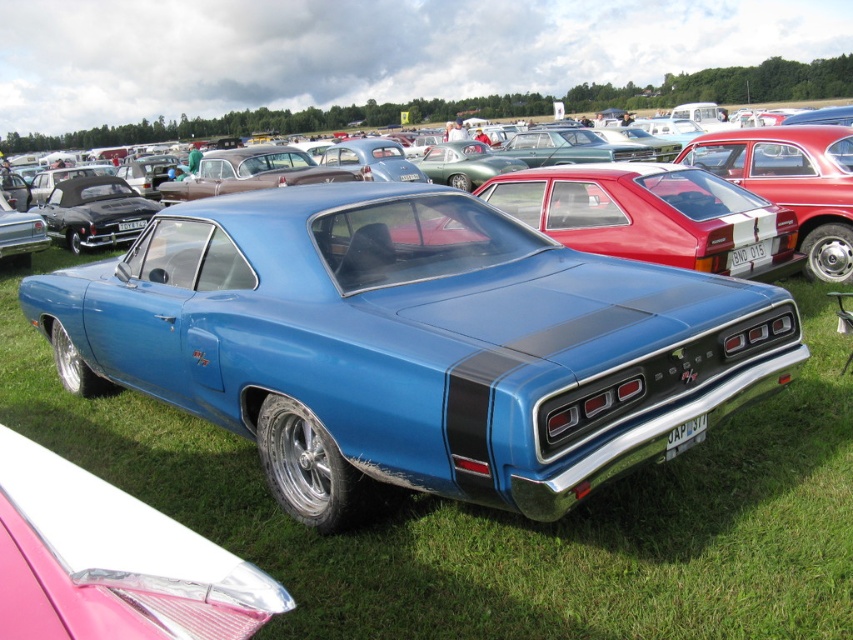
You are a photographer at the car show and want to capture the metallic blue muscle car at center without any obstruction from the metallic blue car at center. Which one should you move to get a clear shot?

The metallic blue muscle car at center is positioned under the metallic blue car at center, so you should move the metallic blue car at center to get a clear shot of the metallic blue muscle car at center.

You are a photographer at a car show and need to capture both the metallic blue muscle car at center and the metallic blue car at center in a single frame. Which car should you focus on first to ensure both fit in the shot?

The metallic blue muscle car at center is thinner than the metallic blue car at center, so you should focus on the metallic blue car at center first to ensure both fit in the shot.